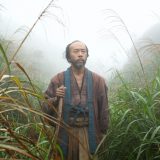
In order to click on chest in this screenshot , I will do `click(80, 82)`.